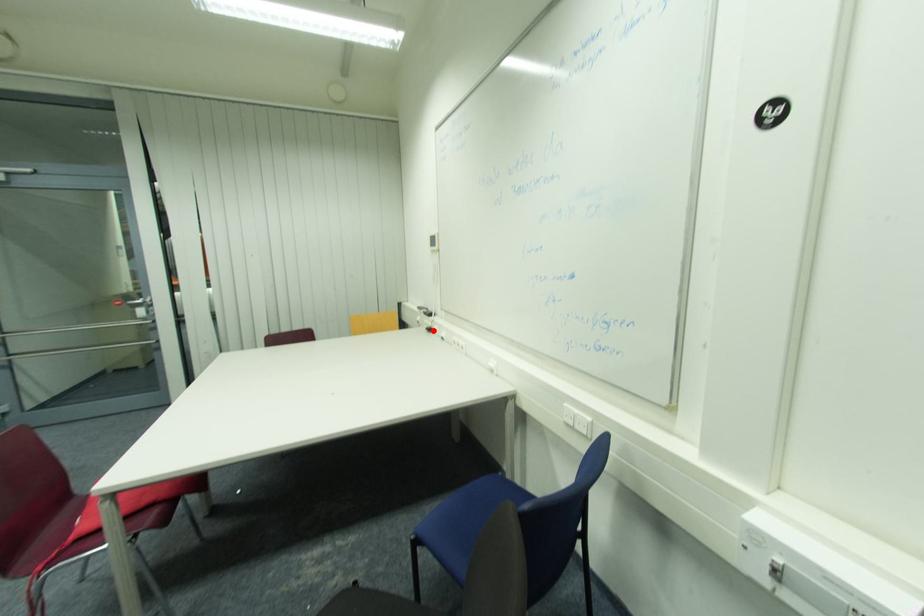
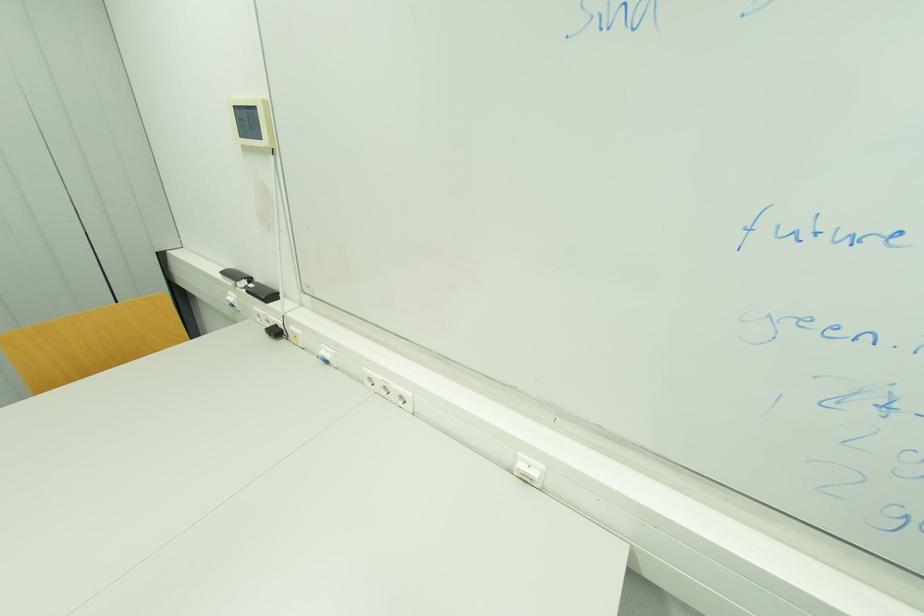
Where in the second image is the point corresponding to the highlighted location from the first image?

(281, 333)